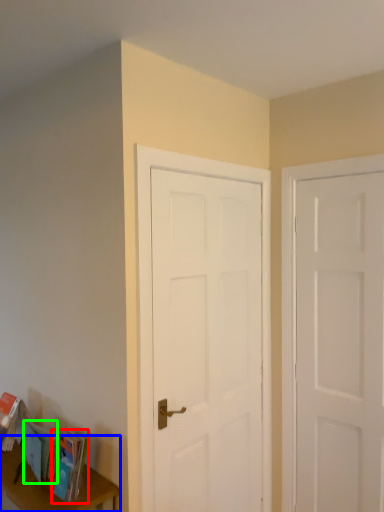
Question: Which is farther away from paperback book (highlighted by a red box)? table (highlighted by a blue box) or book (highlighted by a green box)?

Choices:
 (A) table
 (B) book

Answer: (A)